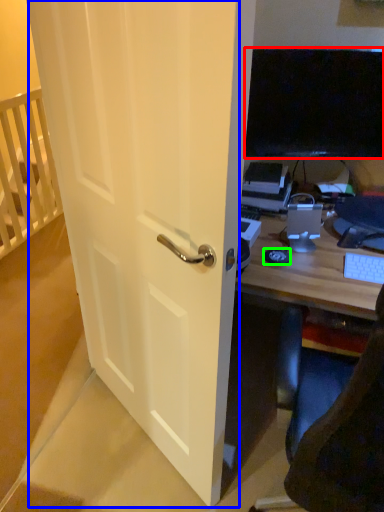
Question: Estimate the real-world distances between objects in this image. Which object is closer to television (highlighted by a red box), screen door (highlighted by a blue box) or mousepad (highlighted by a green box)?

Choices:
 (A) screen door
 (B) mousepad

Answer: (B)